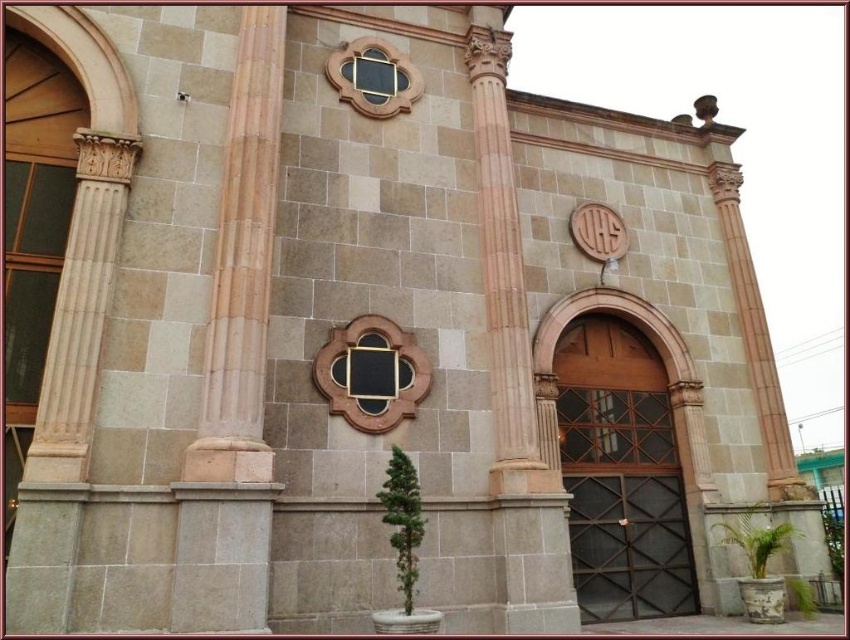
Question: Which object appears closest to the camera in this image?

Choices:
 (A) black matte window at center
 (B) sandy stone column at left
 (C) matte gold window at upper center

Answer: (B)

Question: Which of the following is the farthest from the observer?

Choices:
 (A) (337, 346)
 (B) (387, 65)
 (C) (238, 317)

Answer: (B)

Question: Can you confirm if black matte window at center is thinner than matte gold window at upper center?

Choices:
 (A) yes
 (B) no

Answer: (B)

Question: Estimate the real-world distances between objects in this image. Which object is closer to the sandy stone column at left?

Choices:
 (A) matte gold window at upper center
 (B) black matte window at center

Answer: (B)

Question: Is black matte window at center thinner than matte gold window at upper center?

Choices:
 (A) no
 (B) yes

Answer: (A)

Question: Is black matte window at center bigger than matte gold window at upper center?

Choices:
 (A) no
 (B) yes

Answer: (B)